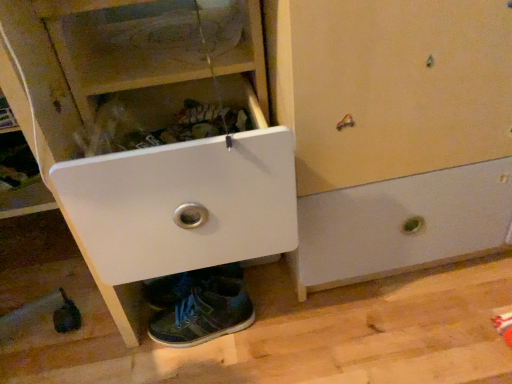
Looking at this image, what is the approximate width of green suede shoes at lower center?

green suede shoes at lower center is 3.38 inches wide.

This screenshot has width=512, height=384. What do you see at coordinates (204, 315) in the screenshot? I see `green suede shoes at lower center` at bounding box center [204, 315].

Identify the location of green suede shoes at lower center. Image resolution: width=512 pixels, height=384 pixels. (204, 315).

Identify the location of green suede shoes at lower center. The image size is (512, 384). [x=204, y=315].